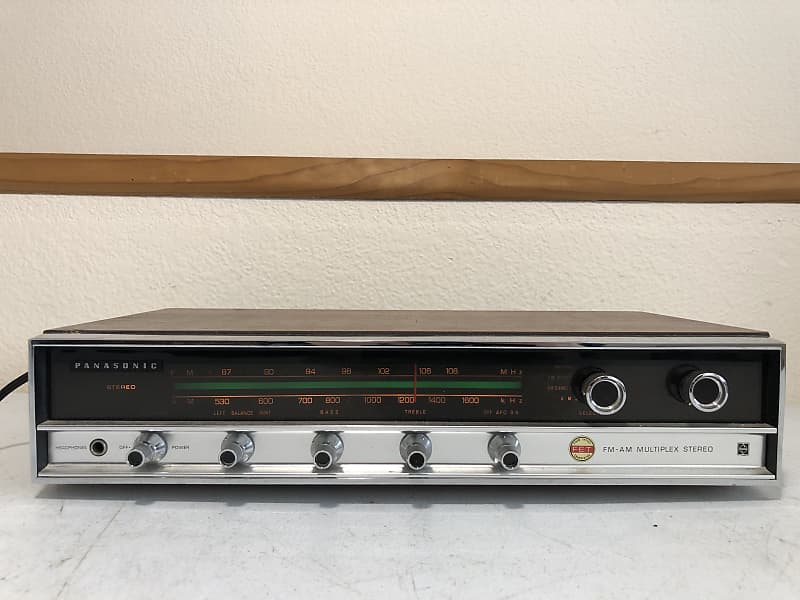
Locate an element on the screen. The width and height of the screenshot is (800, 600). cord is located at coordinates pyautogui.click(x=10, y=385).